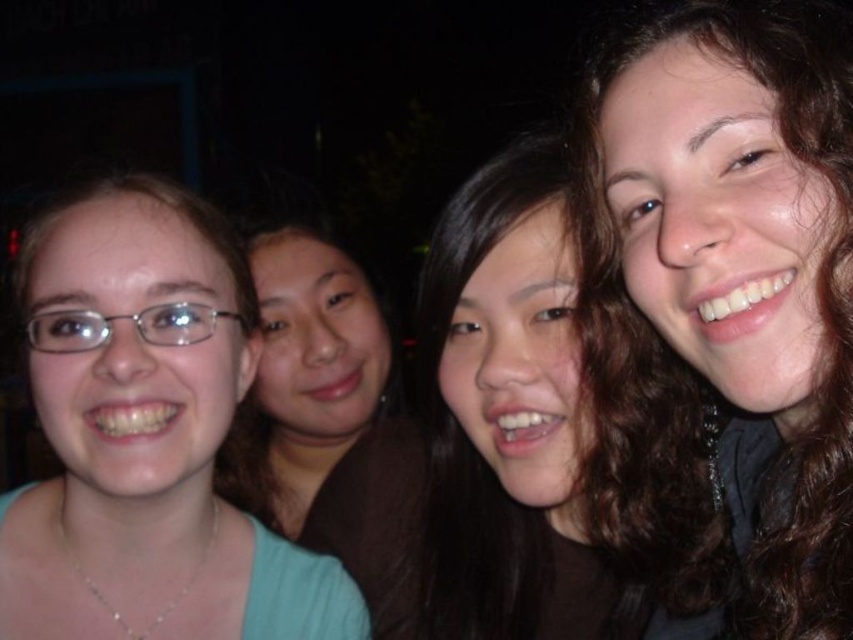
Between point (485, 394) and point (288, 522), which one is positioned behind?

Positioned behind is point (288, 522).

What do you see at coordinates (509, 417) in the screenshot? I see `dark brown hair at center` at bounding box center [509, 417].

Who is more distant from viewer, (434, 237) or (270, 282)?

The point (270, 282) is behind.

Find the location of a particular element. The height and width of the screenshot is (640, 853). dark brown hair at center is located at coordinates (509, 417).

Does brown curly hair at center appear under dark brown hair at center?

No.

Looking at this image, is brown curly hair at center to the right of dark brown hair at center from the viewer's perspective?

Correct, you'll find brown curly hair at center to the right of dark brown hair at center.

I want to click on brown curly hair at center, so click(x=724, y=310).

Identify the location of brown curly hair at center. The image size is (853, 640). (724, 310).

From the picture: Who is taller, matte teal shirt at left or smooth brown hair at center?

Standing taller between the two is smooth brown hair at center.

Does matte teal shirt at left have a greater width compared to smooth brown hair at center?

In fact, matte teal shirt at left might be narrower than smooth brown hair at center.

Is point (94, 449) positioned before point (393, 438)?

Yes, point (94, 449) is in front of point (393, 438).

Where is `matte teal shirt at left`? The height and width of the screenshot is (640, 853). matte teal shirt at left is located at coordinates (146, 435).